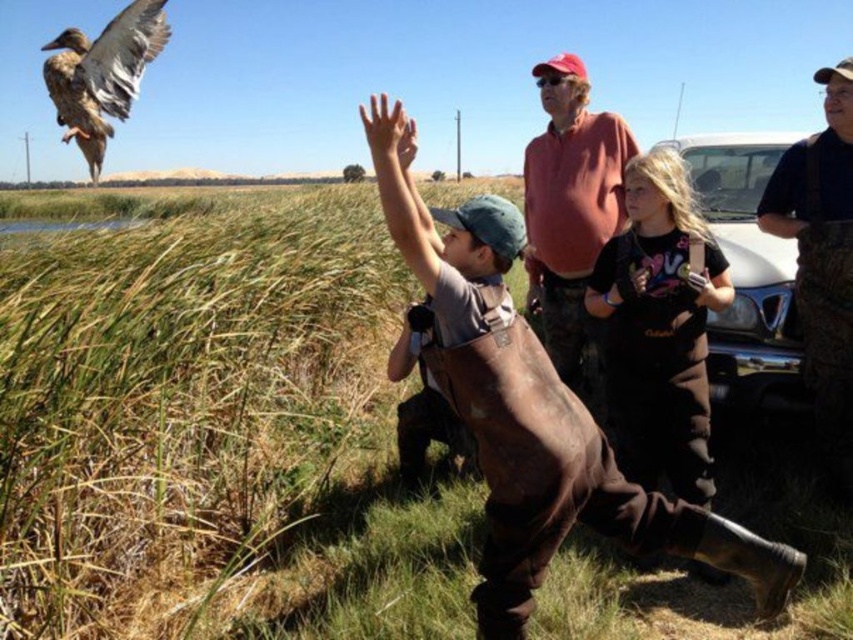
Is brown leather overalls at center further to the viewer compared to brown feathered duck at upper left?

No, brown leather overalls at center is closer to the viewer.

Is brown leather overalls at center taller than brown feathered duck at upper left?

Indeed, brown leather overalls at center has a greater height compared to brown feathered duck at upper left.

This screenshot has height=640, width=853. I want to click on brown leather overalls at center, so click(531, 410).

Is the position of brown leather overalls at center more distant than that of black cotton shirt at center?

No.

Which is more to the left, brown leather overalls at center or black cotton shirt at center?

brown leather overalls at center is more to the left.

Between point (548, 452) and point (633, 342), which one is positioned in front?

Point (548, 452)

I want to click on brown leather overalls at center, so click(531, 410).

Which of these two, brown leather overalls at center or brown camo overalls at right, stands taller?

brown leather overalls at center is taller.

Who is more forward, (509, 246) or (782, 237)?

Point (509, 246) is more forward.

Is point (524, 380) closer to camera compared to point (846, 92)?

That is True.

Where is `brown leather overalls at center`? This screenshot has width=853, height=640. brown leather overalls at center is located at coordinates (531, 410).